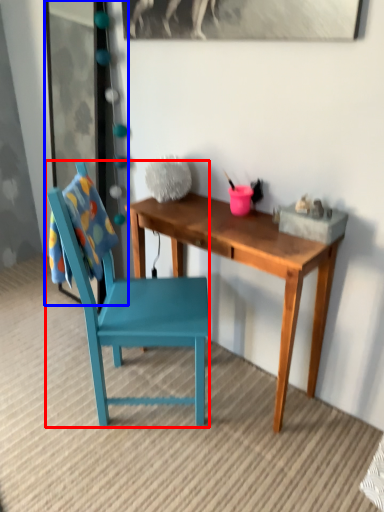
Question: Which of the following is the farthest to the observer, chair (highlighted by a red box) or glass door (highlighted by a blue box)?

Choices:
 (A) chair
 (B) glass door

Answer: (B)